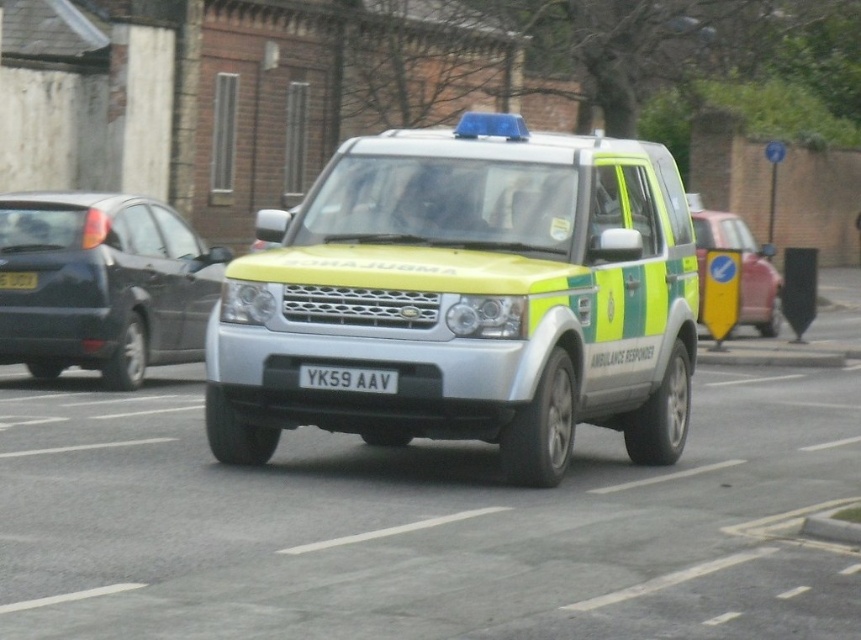
Question: Which object appears farthest from the camera in this image?

Choices:
 (A) yellow-green plastic sign at right
 (B) white plastic license plate at center

Answer: (B)

Question: Does matte black car at left have a larger size compared to white plastic license plate at center?

Choices:
 (A) no
 (B) yes

Answer: (B)

Question: Can you confirm if matte black car at left is positioned below yellow-green plastic sign at right?

Choices:
 (A) no
 (B) yes

Answer: (B)

Question: Among these objects, which one is farthest from the camera?

Choices:
 (A) yellow matte license plate at center
 (B) metallic silver ambulance at center
 (C) yellow-green plastic sign at right

Answer: (C)

Question: Does metallic silver ambulance at center have a lesser width compared to matte black car at left?

Choices:
 (A) no
 (B) yes

Answer: (A)

Question: Based on their relative distances, which object is farther from the metallic silver ambulance at center?

Choices:
 (A) yellow matte license plate at center
 (B) yellow-green plastic sign at right
 (C) white plastic license plate at center

Answer: (C)